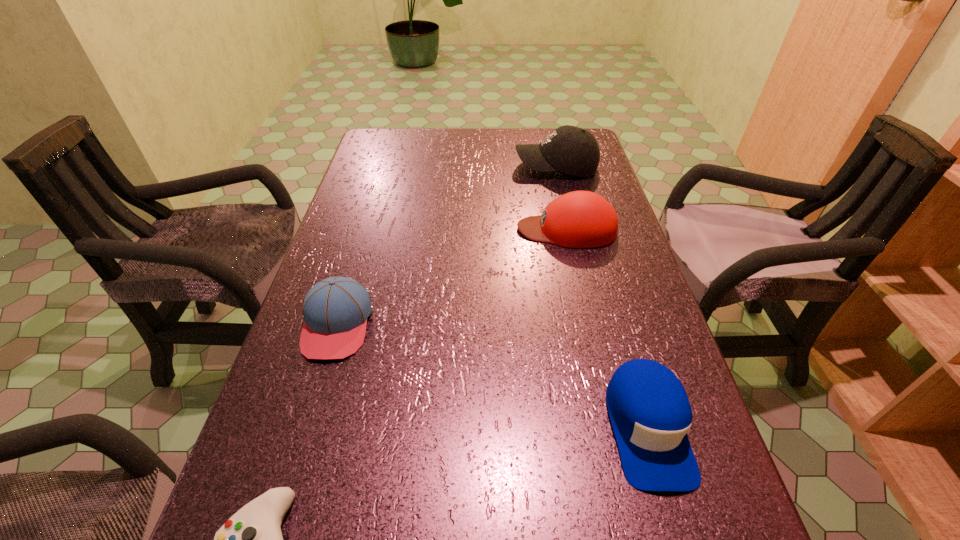
The height and width of the screenshot is (540, 960). In order to click on the farthest baseball cap in this screenshot , I will do click(x=569, y=149).

Where is `the tallest object`? This screenshot has height=540, width=960. the tallest object is located at coordinates (569, 149).

At what (x,y) coordinates should I click in order to perform the action: click on the second farthest baseball cap. Please return your answer as a coordinate pair (x, y). Looking at the image, I should click on (580, 219).

The width and height of the screenshot is (960, 540). I want to click on the nearest baseball cap, so click(x=650, y=413).

Identify the location of the third nearest object. (335, 310).

Image resolution: width=960 pixels, height=540 pixels. I want to click on the leftmost baseball cap, so click(335, 310).

Find the location of a particular element. This screenshot has height=540, width=960. free location located on the front-facing side of the tallest object is located at coordinates pos(492,167).

Identify the location of vacant space situated 0.060m on the front-facing side of the tallest object. The image size is (960, 540). (495, 167).

At what (x,y) coordinates should I click in order to perform the action: click on vacant position located on the front-facing side of the tallest object. Please return your answer as a coordinate pair (x, y). Image resolution: width=960 pixels, height=540 pixels. Looking at the image, I should click on (420, 167).

Where is `vacant space located on the front-facing side of the third nearest baseball cap`? vacant space located on the front-facing side of the third nearest baseball cap is located at coordinates (x=422, y=229).